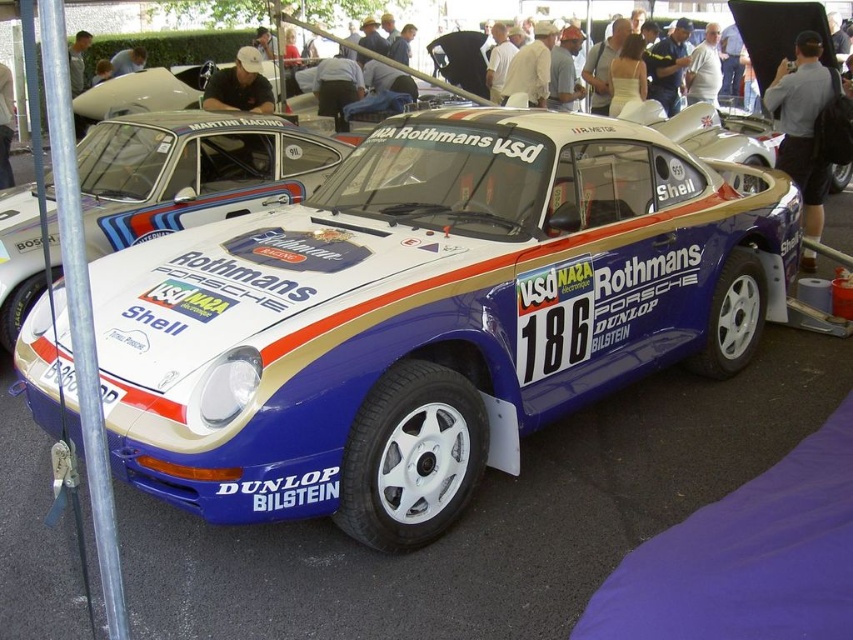
You are a photographer at the car show and need to position your camera so that the white matte porsche at center and the light brown leather jacket at upper center are both in frame. Given their height differences, which object should you adjust the camera angle to focus on to ensure both are visible without cropping?

The white matte porsche at center is taller than the light brown leather jacket at upper center. To ensure both are visible without cropping, you should position the camera to focus on the white matte porsche at center and lower the angle slightly to include the light brown leather jacket at upper center in the frame.